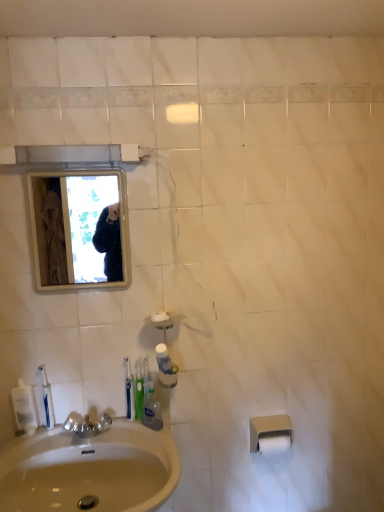
Question: From a real-world perspective, is white matte toilet paper at lower right, which appears as the second toilet paper when viewed from the top, over clear plastic mouthwash at lower left, the second mouthwash from the right?

Choices:
 (A) yes
 (B) no

Answer: (B)

Question: Is white matte toilet paper at lower right, marked as the first toilet paper in a bottom-to-top arrangement, aimed at clear plastic mouthwash at lower left, the 2th mouthwash when ordered from left to right?

Choices:
 (A) no
 (B) yes

Answer: (A)

Question: Is white matte toilet paper at lower right, which appears as the second toilet paper when viewed from the top, to the left of clear plastic mouthwash at lower left, the 2th mouthwash when ordered from left to right, from the viewer's perspective?

Choices:
 (A) no
 (B) yes

Answer: (A)

Question: Is white matte toilet paper at lower right, marked as the first toilet paper in a bottom-to-top arrangement, next to clear plastic mouthwash at lower left, the second mouthwash from the right?

Choices:
 (A) yes
 (B) no

Answer: (B)

Question: Does white matte toilet paper at lower right, marked as the first toilet paper in a bottom-to-top arrangement, have a larger size compared to clear plastic mouthwash at lower left, the second mouthwash from the right?

Choices:
 (A) no
 (B) yes

Answer: (B)

Question: Can you confirm if white matte toilet paper at lower right, which appears as the second toilet paper when viewed from the top, is taller than clear plastic mouthwash at lower left, the 2th mouthwash when ordered from left to right?

Choices:
 (A) no
 (B) yes

Answer: (A)

Question: Does green plastic toothbrush at sink, the first toothbrush when ordered from right to left, have a lesser height compared to clear plastic mouthwash at lower left, the 2th mouthwash when ordered from left to right?

Choices:
 (A) no
 (B) yes

Answer: (A)

Question: Is green plastic toothbrush at sink, the second toothbrush in the left-to-right sequence, far away from clear plastic mouthwash at lower left, the 2th mouthwash when ordered from left to right?

Choices:
 (A) yes
 (B) no

Answer: (B)

Question: From a real-world perspective, is green plastic toothbrush at sink, the first toothbrush when ordered from right to left, physically below clear plastic mouthwash at lower left, the second mouthwash from the right?

Choices:
 (A) no
 (B) yes

Answer: (A)

Question: Is green plastic toothbrush at sink, the first toothbrush when ordered from right to left, thinner than clear plastic mouthwash at lower left, the second mouthwash from the right?

Choices:
 (A) yes
 (B) no

Answer: (B)

Question: Is green plastic toothbrush at sink, the second toothbrush in the left-to-right sequence, closer to the viewer compared to clear plastic mouthwash at lower left, the 2th mouthwash when ordered from left to right?

Choices:
 (A) yes
 (B) no

Answer: (B)

Question: Is clear plastic mouthwash at lower left, the 2th mouthwash when ordered from left to right, at the back of green plastic toothbrush at sink, the first toothbrush when ordered from right to left?

Choices:
 (A) yes
 (B) no

Answer: (B)

Question: From a real-world perspective, is clear plastic mouthwash at lower left, marked as the first mouthwash in a left-to-right arrangement, on clear plastic mouthwash at lower left, the 2th mouthwash when ordered from left to right?

Choices:
 (A) yes
 (B) no

Answer: (B)